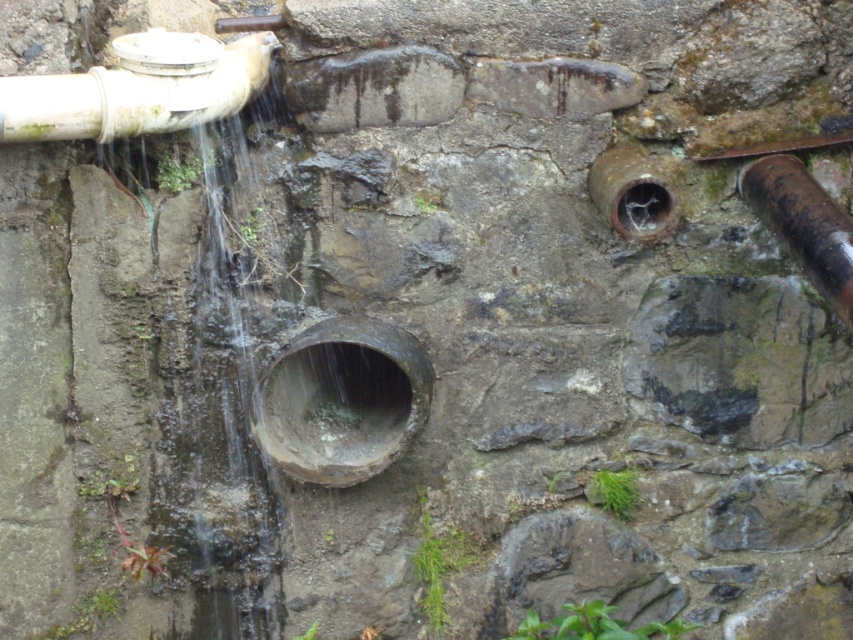
Question: Does white matte water pipe at upper left come behind rusty metal pipe at right?

Choices:
 (A) yes
 (B) no

Answer: (A)

Question: In this image, where is rusty metal pipe at center located relative to white matte water pipe at upper left?

Choices:
 (A) above
 (B) below

Answer: (B)

Question: Which of these objects is positioned farthest from the rusty metal pipe at center?

Choices:
 (A) white matte water pipe at upper left
 (B) rusty metal pipe at right

Answer: (B)

Question: Which point is closer to the camera taking this photo?

Choices:
 (A) (172, 36)
 (B) (813, 220)
 (C) (373, 472)

Answer: (B)

Question: Which point is farther from the camera taking this photo?

Choices:
 (A) (370, 353)
 (B) (32, 112)

Answer: (A)

Question: Is rusty metal pipe at center bigger than rusty metal pipe at right?

Choices:
 (A) yes
 (B) no

Answer: (A)